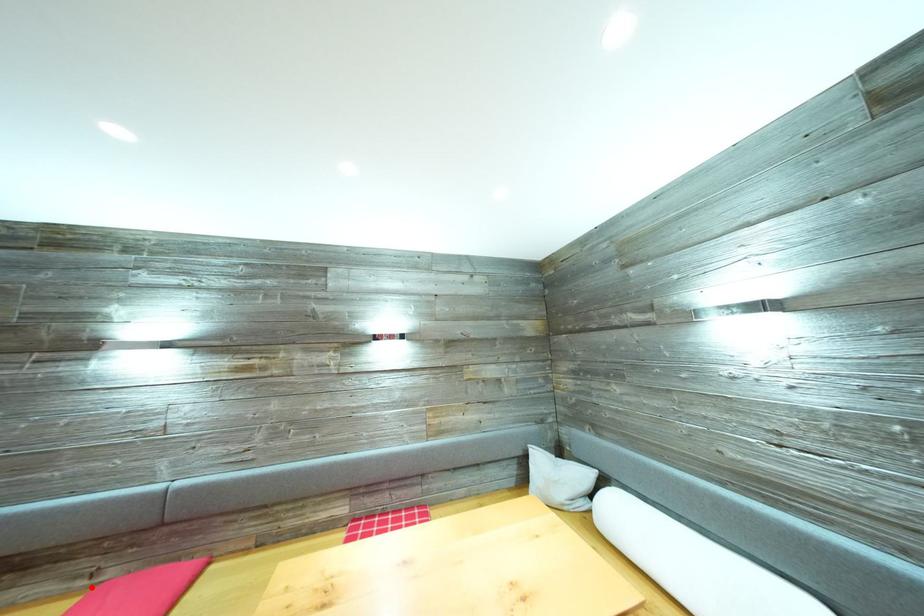
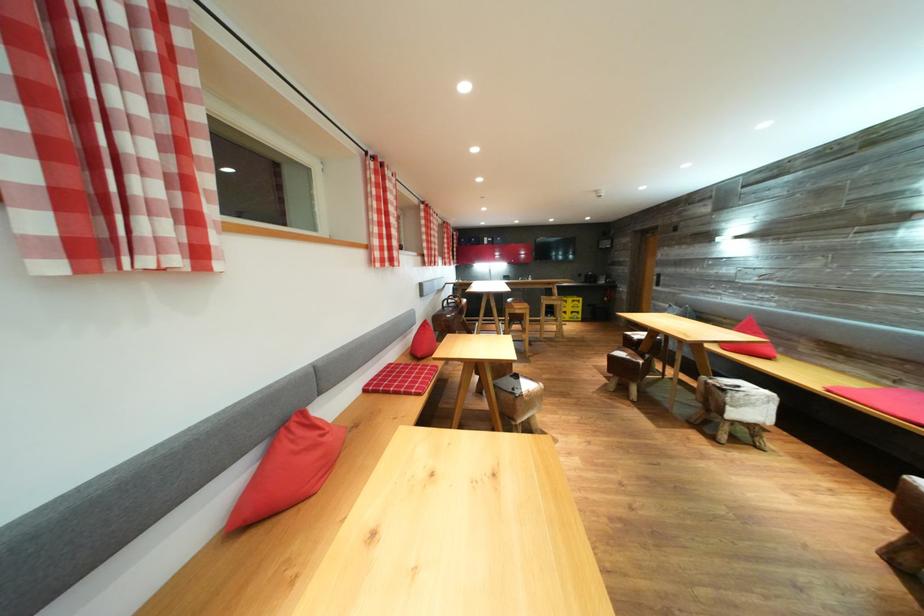
The point at the highlighted location is marked in the first image. Where is the corresponding point in the second image?

(895, 389)